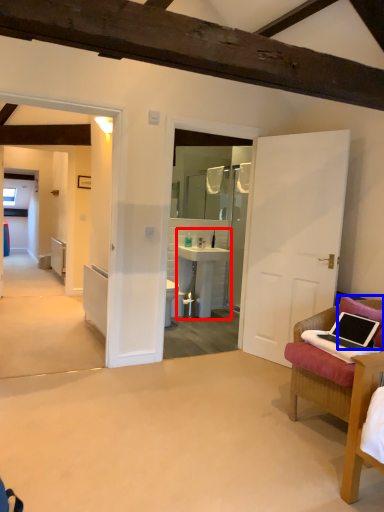
Question: Which of the following is the closest to the observer, sink (highlighted by a red box) or pillow (highlighted by a blue box)?

Choices:
 (A) sink
 (B) pillow

Answer: (B)